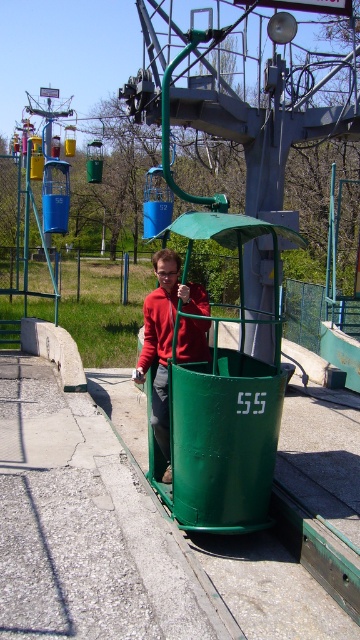
Measure the distance between point (144, 317) and camera.

They are 10.51 meters apart.

Between matte red sweater at center and matte red jacket at center, which one is positioned lower?

Positioned lower is matte red sweater at center.

The image size is (360, 640). I want to click on matte red sweater at center, so click(164, 339).